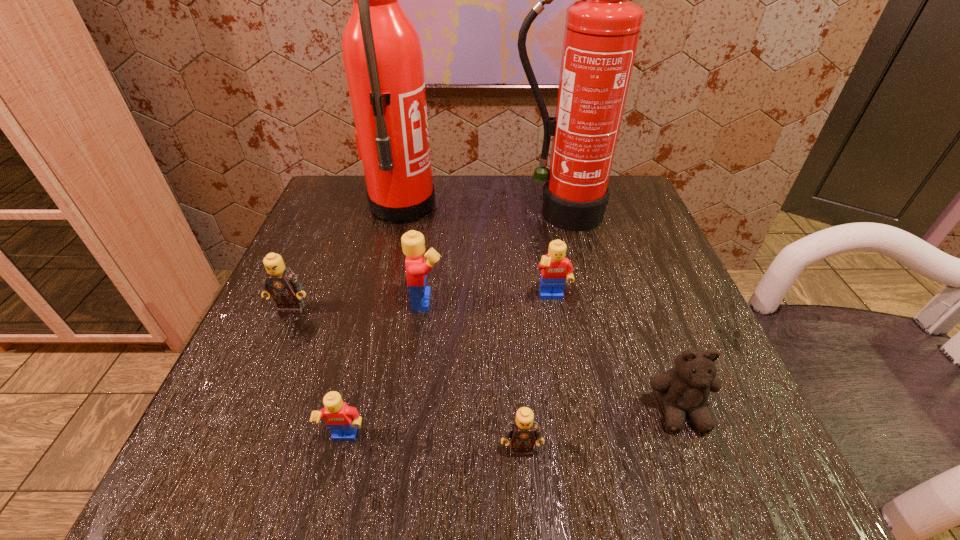
Identify the location of the second Lego from left to right. (342, 420).

The height and width of the screenshot is (540, 960). I want to click on the nearer tan Lego, so click(x=522, y=431).

The height and width of the screenshot is (540, 960). I want to click on the smaller tan Lego, so click(x=522, y=431).

You are a GUI agent. You are given a task and a screenshot of the screen. Output one action in this format:
    pyautogui.click(x=<x>, y=<y>)
    Task: Click on the vacant space situated on the label side of the left fire extinguisher
    The height and width of the screenshot is (540, 960).
    Given the screenshot: What is the action you would take?
    pyautogui.click(x=580, y=207)

In order to click on vacant space located 0.130m on the front-facing side of the red fire extinguisher in this screenshot , I will do `click(575, 273)`.

This screenshot has height=540, width=960. I want to click on vacant space located on the face of the tallest Lego, so click(518, 300).

Locate an element on the screen. The height and width of the screenshot is (540, 960). vacant area located 0.280m on the face of the second smallest yellow Lego is located at coordinates (582, 468).

Find the location of a particular element. free space located 0.280m in front of the farther tan Lego is located at coordinates (218, 479).

Identify the location of teddy bear that is positioned at the near edge. (684, 390).

Locate an element on the screen. This screenshot has width=960, height=540. fire extinguisher located at the left edge is located at coordinates (381, 50).